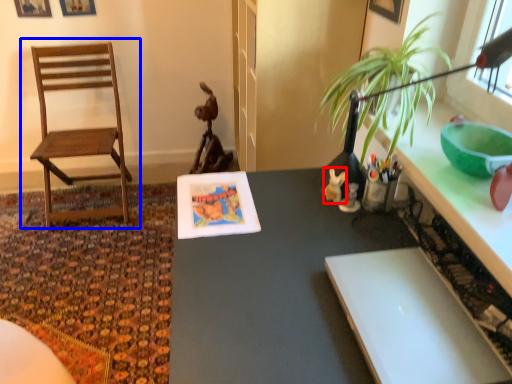
Question: Which point is closer to the camera, toy (highlighted by a red box) or chair (highlighted by a blue box)?

Choices:
 (A) toy
 (B) chair

Answer: (A)